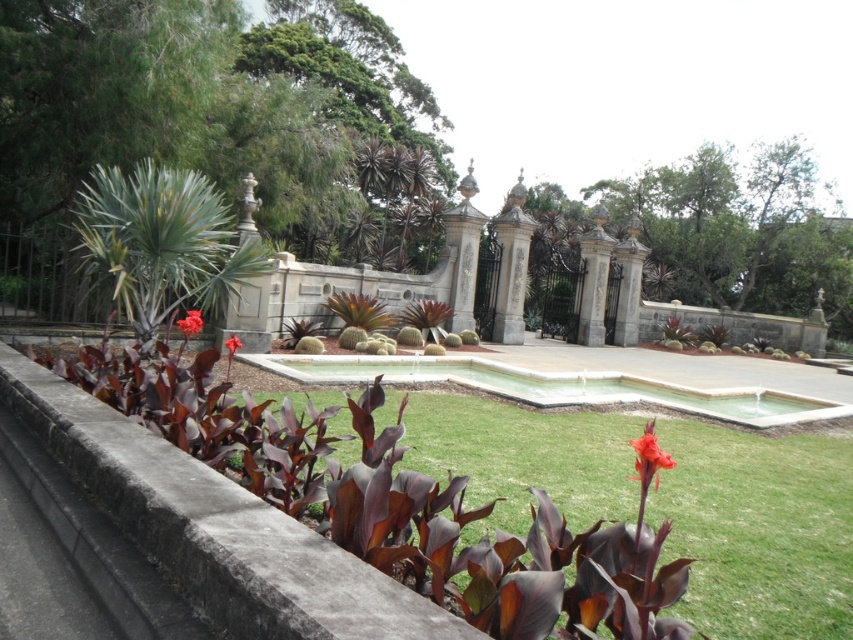
You are planning to install a new lighting system for the garden. The lights are to be placed on the white concrete pool at center and purple matte flower at lower left. According to the garden layout, which object is located below the other?

The white concrete pool at center is positioned under the purple matte flower at lower left, so the pool is below the flower.